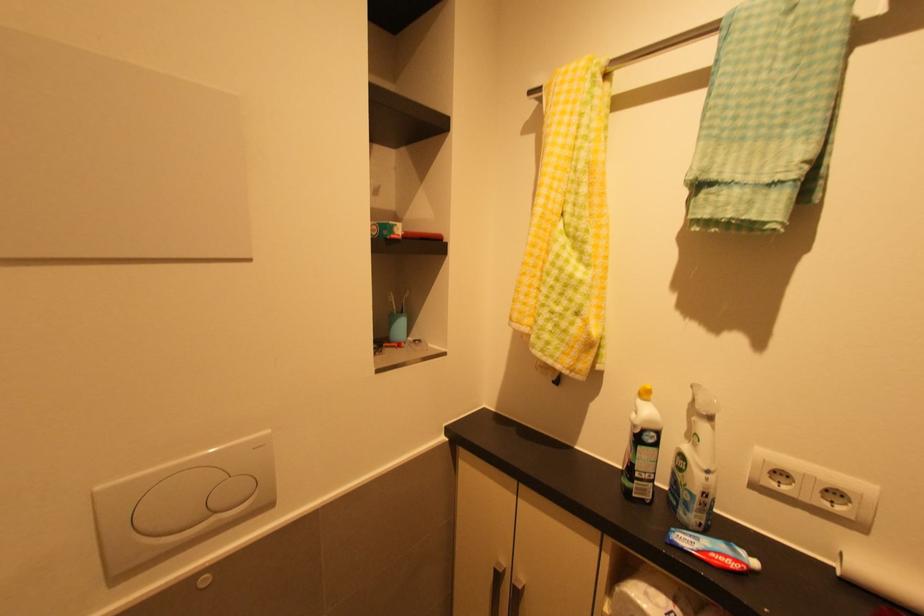
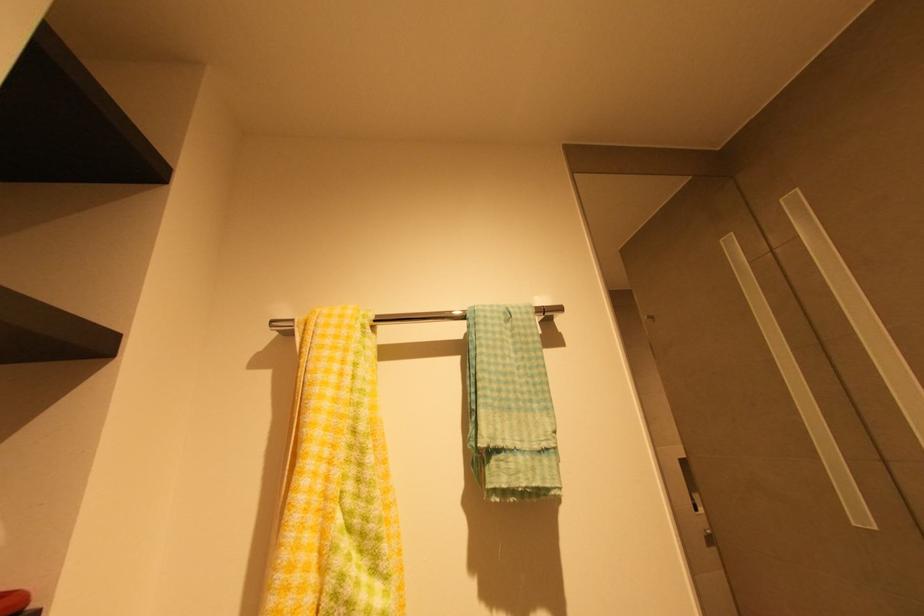
First-person continuous shooting, in which direction is the camera rotating?

The camera's rotation is toward right-up.